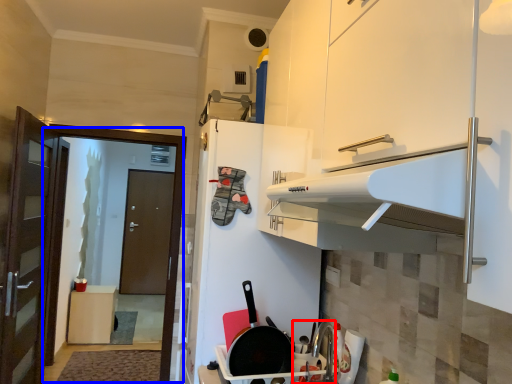
Question: Which of the following is the closest to the observer, sink (highlighted by a red box) or screen door (highlighted by a blue box)?

Choices:
 (A) sink
 (B) screen door

Answer: (A)